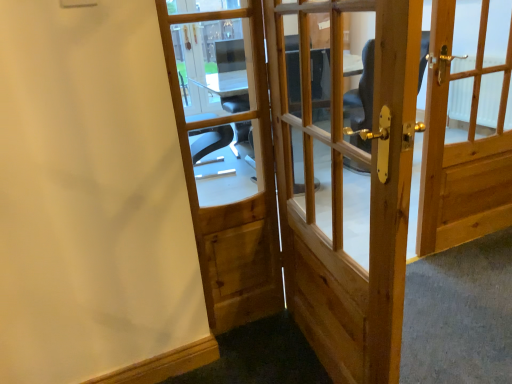
Locate an element on the screen. This screenshot has height=384, width=512. natural wood door at center, which appears as the 2th door when viewed from the left is located at coordinates (346, 185).

Measure the distance between natural wood door at right, which is the first door from right to left, and camera.

natural wood door at right, which is the first door from right to left, and camera are 1.72 meters apart.

You are a GUI agent. You are given a task and a screenshot of the screen. Output one action in this format:
    pyautogui.click(x=<x>, y=<y>)
    Task: Click on the natural wood door at center, which is counted as the third door, starting from the right
    This screenshot has height=384, width=512.
    Given the screenshot: What is the action you would take?
    pyautogui.click(x=226, y=154)

From the image's perspective, is natural wood door at right, the 3th door when ordered from left to right, beneath natural wood door at center, the 2th door when ordered from right to left?

No, from the image's perspective, natural wood door at right, the 3th door when ordered from left to right, is not beneath natural wood door at center, the 2th door when ordered from right to left.

Which point is more forward, (486, 28) or (303, 67)?

The point (303, 67) is in front.

Is natural wood door at right, the 3th door when ordered from left to right, positioned in front of natural wood door at center, which appears as the 2th door when viewed from the left?

No, natural wood door at right, the 3th door when ordered from left to right, is further to the viewer.

Is natural wood door at center, which appears as the 2th door when viewed from the left, completely or partially inside natural wood door at right, which is the first door from right to left?

No, natural wood door at center, which appears as the 2th door when viewed from the left, is not a part of natural wood door at right, which is the first door from right to left.

Locate an element on the screen. the 1st door behind the natural wood door at center, which appears as the 2th door when viewed from the left is located at coordinates (226, 154).

Which object is closer to the camera, natural wood door at center, which appears as the 2th door when viewed from the left, or natural wood door at center, the 1th door viewed from the left?

natural wood door at center, which appears as the 2th door when viewed from the left, is more forward.

Is natural wood door at center, which appears as the 2th door when viewed from the left, looking in the opposite direction of natural wood door at center, the 1th door viewed from the left?

Yes, natural wood door at center, which appears as the 2th door when viewed from the left, is positioned with its back facing natural wood door at center, the 1th door viewed from the left.

From a real-world perspective, is natural wood door at center, which appears as the 2th door when viewed from the left, physically located above or below natural wood door at center, the 1th door viewed from the left?

natural wood door at center, which appears as the 2th door when viewed from the left, is situated lower than natural wood door at center, the 1th door viewed from the left, in the real world.

In terms of size, does natural wood door at right, the 3th door when ordered from left to right, appear bigger or smaller than natural wood door at center, which is counted as the third door, starting from the right?

natural wood door at right, the 3th door when ordered from left to right, is bigger than natural wood door at center, which is counted as the third door, starting from the right.

Relative to natural wood door at center, the 1th door viewed from the left, is natural wood door at right, the 3th door when ordered from left to right, in front or behind?

natural wood door at right, the 3th door when ordered from left to right, is positioned farther from the viewer than natural wood door at center, the 1th door viewed from the left.

From a real-world perspective, who is located higher, natural wood door at right, which is the first door from right to left, or natural wood door at center, the 1th door viewed from the left?

natural wood door at center, the 1th door viewed from the left, is physically above.

From the picture: Which of these two, natural wood door at right, the 3th door when ordered from left to right, or natural wood door at center, which is counted as the third door, starting from the right, stands shorter?

Standing shorter between the two is natural wood door at right, the 3th door when ordered from left to right.

Does point (352, 248) appear closer or farther from the camera than point (506, 103)?

Point (352, 248).

Is natural wood door at center, which appears as the 2th door when viewed from the left, positioned beyond the bounds of natural wood door at right, which is the first door from right to left?

Yes, natural wood door at center, which appears as the 2th door when viewed from the left, is outside of natural wood door at right, which is the first door from right to left.

Is natural wood door at center, the 2th door when ordered from right to left, not near natural wood door at right, the 3th door when ordered from left to right?

They are positioned close to each other.

Which is more to the left, natural wood door at center, which appears as the 2th door when viewed from the left, or natural wood door at right, which is the first door from right to left?

natural wood door at center, which appears as the 2th door when viewed from the left, is more to the left.

From their relative heights in the image, would you say natural wood door at center, the 1th door viewed from the left, is taller or shorter than natural wood door at right, which is the first door from right to left?

In the image, natural wood door at center, the 1th door viewed from the left, appears to be taller than natural wood door at right, which is the first door from right to left.

Is natural wood door at center, which is counted as the third door, starting from the right, facing towards natural wood door at right, which is the first door from right to left?

No, natural wood door at center, which is counted as the third door, starting from the right, is not facing towards natural wood door at right, which is the first door from right to left.

Considering the positions of objects natural wood door at center, the 1th door viewed from the left, and natural wood door at right, which is the first door from right to left, in the image provided, who is more to the right, natural wood door at center, the 1th door viewed from the left, or natural wood door at right, which is the first door from right to left,?

Positioned to the right is natural wood door at right, which is the first door from right to left.

Is natural wood door at center, which is counted as the third door, starting from the right, next to natural wood door at center, which appears as the 2th door when viewed from the left?

No, natural wood door at center, which is counted as the third door, starting from the right, is not touching natural wood door at center, which appears as the 2th door when viewed from the left.

Measure the distance between natural wood door at center, which is counted as the third door, starting from the right, and natural wood door at center, which appears as the 2th door when viewed from the left.

The distance of natural wood door at center, which is counted as the third door, starting from the right, from natural wood door at center, which appears as the 2th door when viewed from the left, is 5.59 feet.

You are a GUI agent. You are given a task and a screenshot of the screen. Output one action in this format:
    pyautogui.click(x=<x>, y=<y>)
    Task: Click on the door above the natural wood door at center, the 2th door when ordered from right to left (from a real-world perspective)
    
    Given the screenshot: What is the action you would take?
    pyautogui.click(x=226, y=154)

Who is taller, natural wood door at center, the 1th door viewed from the left, or natural wood door at center, the 2th door when ordered from right to left?

Standing taller between the two is natural wood door at center, the 2th door when ordered from right to left.

What are the coordinates of `the 2nd door above the natural wood door at center, the 2th door when ordered from right to left (from the image's perspective)` in the screenshot? It's located at (466, 125).

From the natural wood door at center, the 2th door when ordered from right to left, count 1st doors backward and point to it. Please provide its 2D coordinates.

[(226, 154)]

When comparing their distances from natural wood door at center, which appears as the 2th door when viewed from the left, does natural wood door at right, which is the first door from right to left, or natural wood door at center, which is counted as the third door, starting from the right, seem closer?

natural wood door at right, which is the first door from right to left, lies closer to natural wood door at center, which appears as the 2th door when viewed from the left, than the other object.

Looking at the image, which one is located further to natural wood door at center, the 1th door viewed from the left, natural wood door at center, the 2th door when ordered from right to left, or natural wood door at right, which is the first door from right to left?

Among the two, natural wood door at right, which is the first door from right to left, is located further to natural wood door at center, the 1th door viewed from the left.

From the picture: Estimate the real-world distances between objects in this image. Which object is further from natural wood door at center, which is counted as the third door, starting from the right, natural wood door at right, which is the first door from right to left, or natural wood door at center, which appears as the 2th door when viewed from the left?

Among the two, natural wood door at right, which is the first door from right to left, is located further to natural wood door at center, which is counted as the third door, starting from the right.

Which object lies nearer to the anchor point natural wood door at center, which appears as the 2th door when viewed from the left, natural wood door at center, the 1th door viewed from the left, or natural wood door at right, the 3th door when ordered from left to right?

Based on the image, natural wood door at right, the 3th door when ordered from left to right, appears to be nearer to natural wood door at center, which appears as the 2th door when viewed from the left.

When comparing their distances from natural wood door at right, which is the first door from right to left, does natural wood door at center, which is counted as the third door, starting from the right, or natural wood door at center, which appears as the 2th door when viewed from the left, seem further?

Among the two, natural wood door at center, which is counted as the third door, starting from the right, is located further to natural wood door at right, which is the first door from right to left.

Looking at this image, looking at the image, which one is located closer to natural wood door at right, the 3th door when ordered from left to right, natural wood door at center, which appears as the 2th door when viewed from the left, or natural wood door at center, which is counted as the third door, starting from the right?

Among the two, natural wood door at center, which appears as the 2th door when viewed from the left, is located nearer to natural wood door at right, the 3th door when ordered from left to right.

This screenshot has width=512, height=384. Find the location of `door between natural wood door at center, the 1th door viewed from the left, and natural wood door at right, which is the first door from right to left`. door between natural wood door at center, the 1th door viewed from the left, and natural wood door at right, which is the first door from right to left is located at coordinates (346, 185).